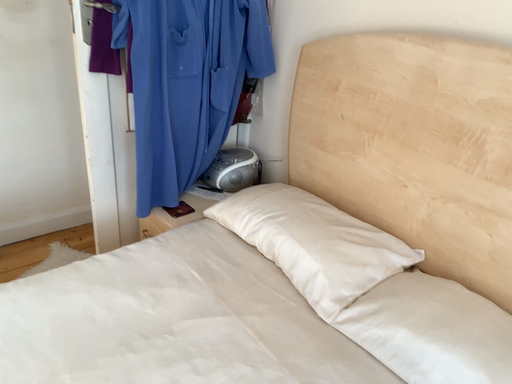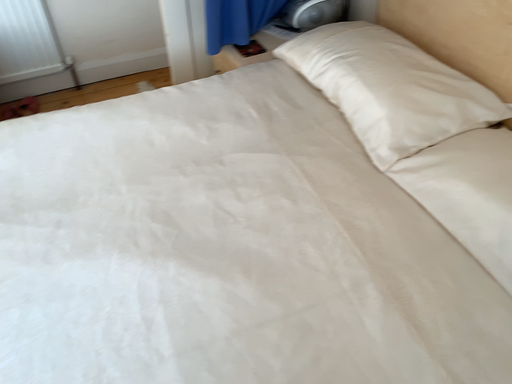
Question: How did the camera likely rotate when shooting the video?

Choices:
 (A) rotated left
 (B) rotated right

Answer: (A)